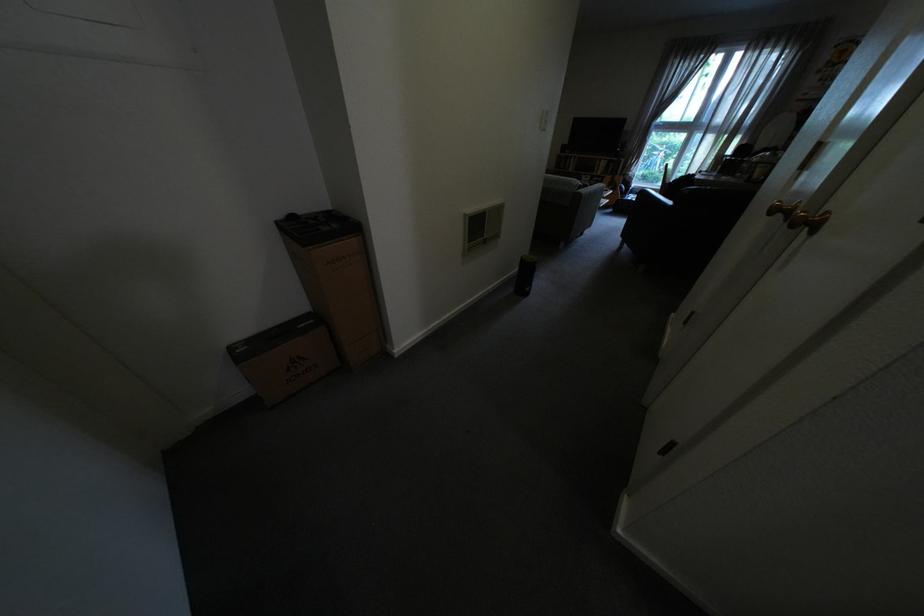
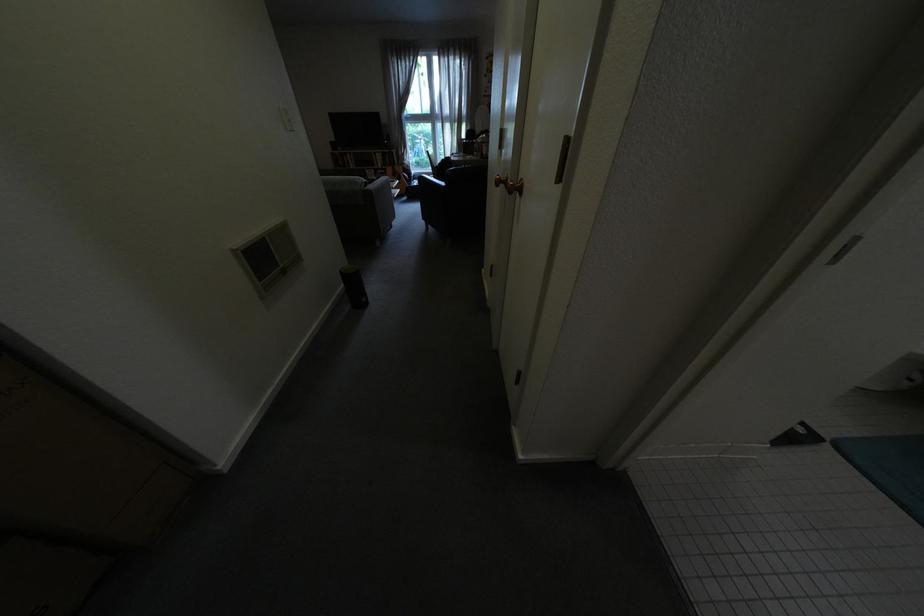
Question: How did the camera likely rotate?

Choices:
 (A) Left
 (B) Right
 (C) Up
 (D) Down

Answer: (B)